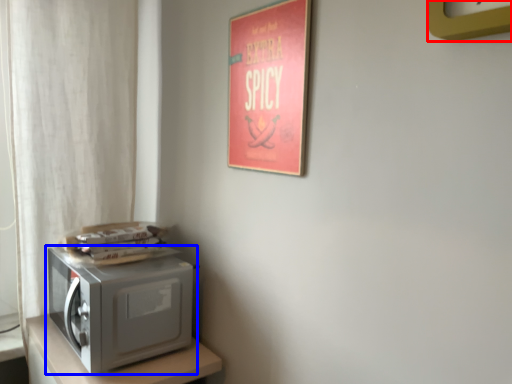
Question: Which of the following is the farthest to the observer, clock (highlighted by a red box) or home appliance (highlighted by a blue box)?

Choices:
 (A) clock
 (B) home appliance

Answer: (B)